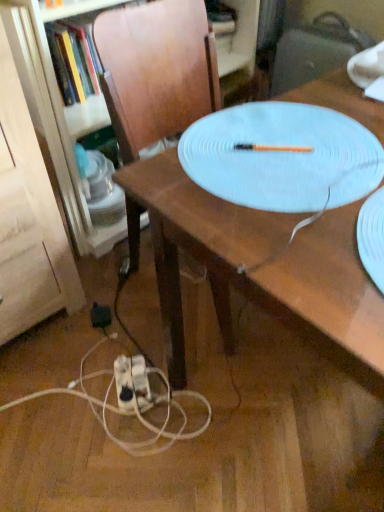
Locate an element on the screen. This screenshot has width=384, height=512. free space in front of black plastic electric outlet at lower left is located at coordinates (87, 360).